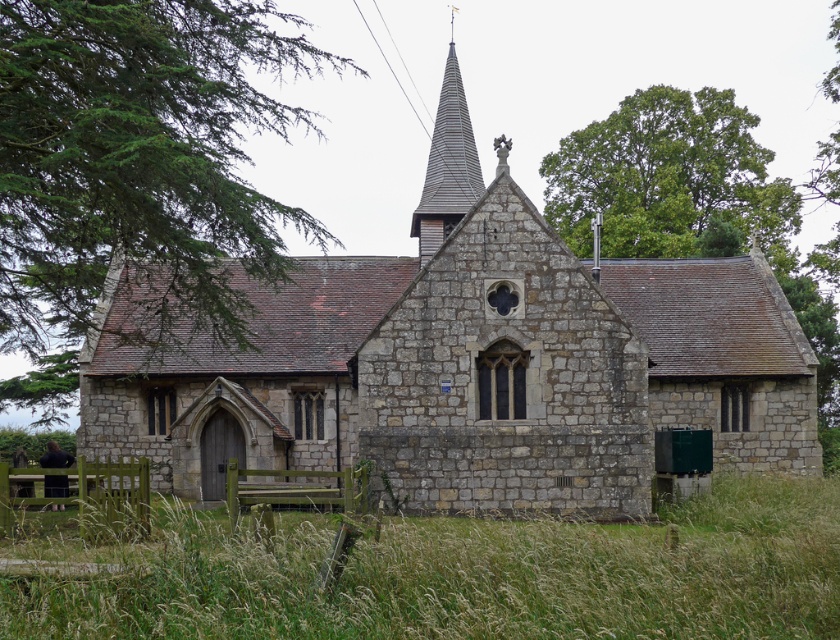
Question: Which point appears closest to the camera in this image?

Choices:
 (A) (161, 483)
 (B) (807, 636)

Answer: (B)

Question: Can you confirm if green grass at lower center is positioned above green leafy tree at upper right?

Choices:
 (A) no
 (B) yes

Answer: (A)

Question: Which of the following is the farthest from the observer?

Choices:
 (A) (447, 83)
 (B) (109, 177)

Answer: (A)

Question: Is stone church at center to the right of gray shingled spire at center from the viewer's perspective?

Choices:
 (A) no
 (B) yes

Answer: (A)

Question: Is green grass at lower center smaller than gray shingled spire at center?

Choices:
 (A) yes
 (B) no

Answer: (A)

Question: Which is nearer to the stone church at center?

Choices:
 (A) green leafy tree at upper right
 (B) green leafy tree at upper left
 (C) green grass at lower center

Answer: (C)